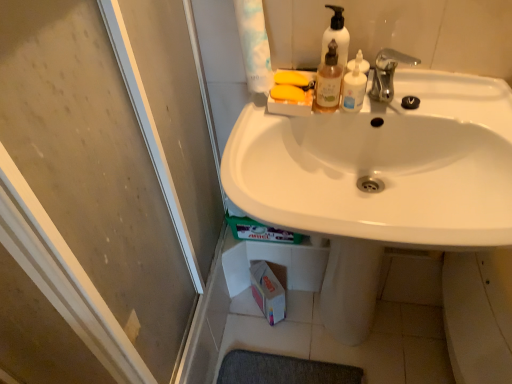
Locate an element on the screen. The image size is (512, 384). free location to the right of translucent plastic bottle at upper center, which is the first mouthwash in left-to-right order is located at coordinates (420, 97).